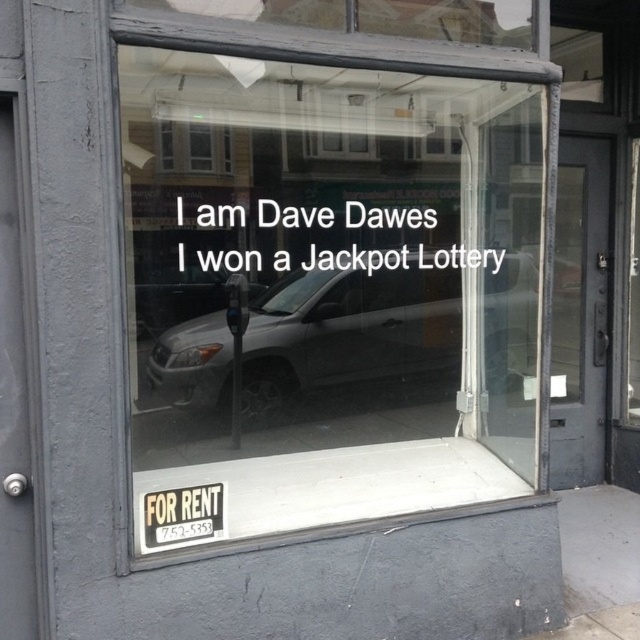
Looking at this image, you are a delivery person trying to park your 2.5 meter wide van. You see the gray matte suv at center and the metallic gray parking meter at center in the storefront window reflection. Can your van fit between them if they are aligned side by side?

The gray matte suv at center might be wider than metallic gray parking meter at center, so it is uncertain if the van can fit between them. You should measure the space first before attempting to park.

Looking at this image, you are standing in front of the storefront window and see the point at coordinates (349, 326). What object is this point located on?

The point at coordinates (349, 326) is located on the gray matte suv at center.